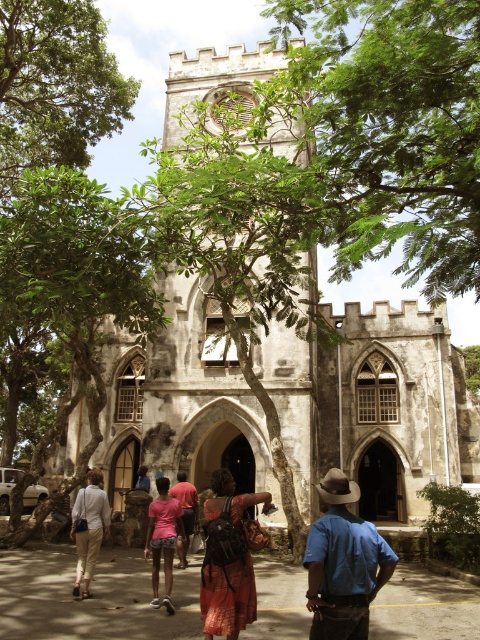
You are standing in front of the historic church and notice the white stone tower at center and the light beige pants at lower left. Based on their positions, which object is closer to the front of the scene?

The light beige pants at lower left are closer to the front of the scene because the white stone tower at center is positioned over it, indicating it is further back.

You are standing in front of the historic church and notice two points marked on the facade. The first point is at coordinates point (228, 561) and the second is at point (93, 529). Which of these points is nearer to your current position?

Point (228, 561) is closer to the camera than point (93, 529), so it is nearer to your current position.

You are standing in front of the historic church and notice a printed cotton dress at center and light beige pants at lower left. Which item of clothing is taller?

The printed cotton dress at center is taller than the light beige pants at lower left.